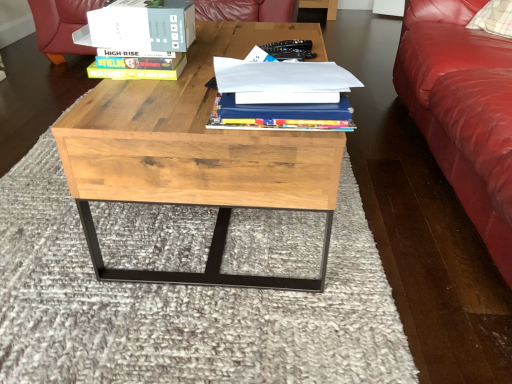
Question: Can you confirm if blue hardcover book at center is positioned to the left of white cardboard box at upper center?

Choices:
 (A) no
 (B) yes

Answer: (A)

Question: Does blue hardcover book at center have a greater height compared to white cardboard box at upper center?

Choices:
 (A) no
 (B) yes

Answer: (A)

Question: Does blue hardcover book at center appear on the right side of white cardboard box at upper center?

Choices:
 (A) no
 (B) yes

Answer: (B)

Question: Does blue hardcover book at center have a larger size compared to white cardboard box at upper center?

Choices:
 (A) yes
 (B) no

Answer: (A)

Question: Can you confirm if blue hardcover book at center is thinner than white cardboard box at upper center?

Choices:
 (A) no
 (B) yes

Answer: (A)

Question: From a real-world perspective, is blue hardcover book at center over white cardboard box at upper center?

Choices:
 (A) no
 (B) yes

Answer: (A)

Question: Does hardcover book at upper left have a greater width compared to natural wood coffee table at center?

Choices:
 (A) yes
 (B) no

Answer: (B)

Question: From a real-world perspective, is hardcover book at upper left physically above natural wood coffee table at center?

Choices:
 (A) no
 (B) yes

Answer: (B)

Question: Does hardcover book at upper left have a lesser width compared to natural wood coffee table at center?

Choices:
 (A) yes
 (B) no

Answer: (A)

Question: From a real-world perspective, is hardcover book at upper left physically below natural wood coffee table at center?

Choices:
 (A) no
 (B) yes

Answer: (A)

Question: Is hardcover book at upper left with natural wood coffee table at center?

Choices:
 (A) no
 (B) yes

Answer: (A)

Question: Considering the relative sizes of hardcover book at upper left and natural wood coffee table at center in the image provided, is hardcover book at upper left bigger than natural wood coffee table at center?

Choices:
 (A) yes
 (B) no

Answer: (B)

Question: Is white cardboard box at upper center directly adjacent to hardcover book at upper left?

Choices:
 (A) yes
 (B) no

Answer: (A)